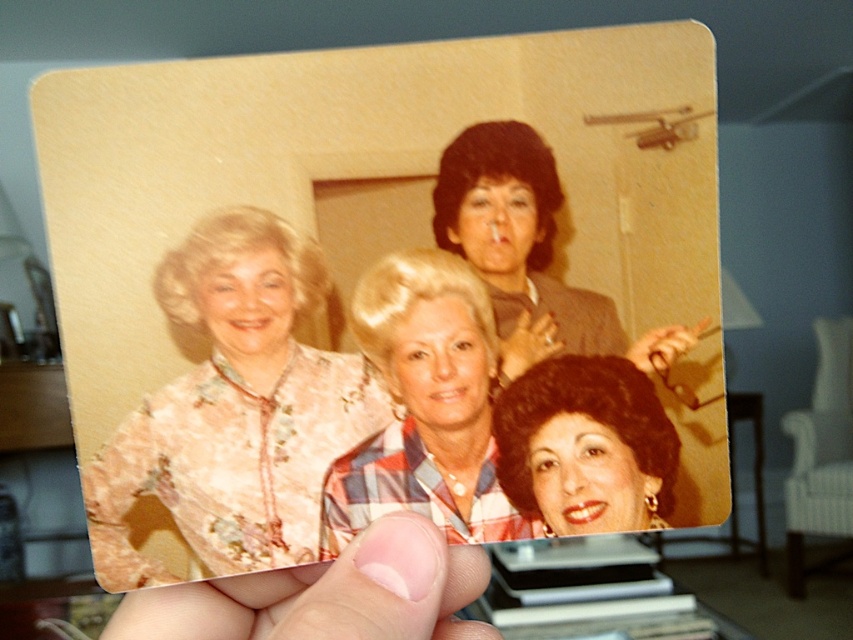
Question: Considering the relative positions of floral-patterned blouse at center and matte gray suit at center in the image provided, where is floral-patterned blouse at center located with respect to matte gray suit at center?

Choices:
 (A) below
 (B) above

Answer: (A)

Question: Which of the following is the farthest from the observer?

Choices:
 (A) plaid fabric shirt at center
 (B) nail polish at lower center
 (C) shiny dark hair at center
 (D) matte gray suit at center

Answer: (C)

Question: Which point appears farthest from the camera in this image?

Choices:
 (A) (466, 432)
 (B) (608, 433)
 (C) (221, 545)
 (D) (451, 570)

Answer: (D)

Question: Is plaid fabric shirt at center to the left of nail polish at lower center from the viewer's perspective?

Choices:
 (A) no
 (B) yes

Answer: (A)

Question: Does floral-patterned blouse at center have a lesser width compared to nail polish at lower center?

Choices:
 (A) no
 (B) yes

Answer: (B)

Question: Which point is farther to the camera?

Choices:
 (A) (375, 600)
 (B) (407, 433)

Answer: (B)